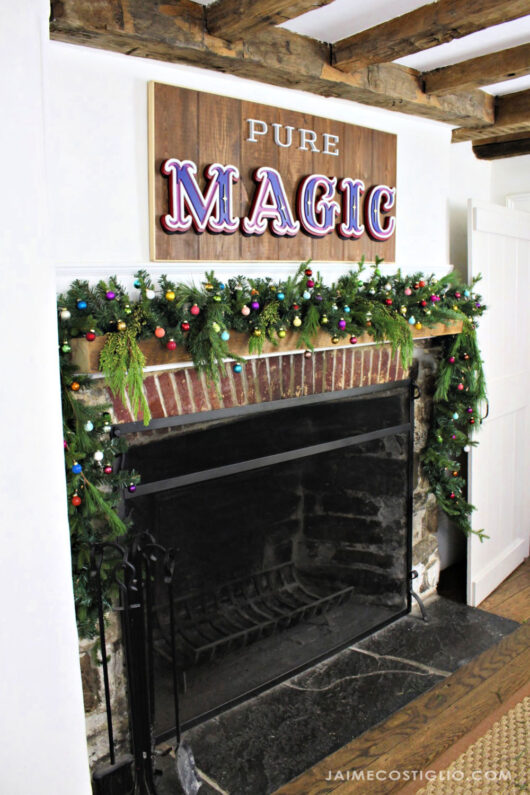
At what (x,y) coordinates should I click in order to perform the action: click on open door. Please return your answer as a coordinate pair (x, y). This screenshot has width=530, height=795. Looking at the image, I should click on (506, 378).